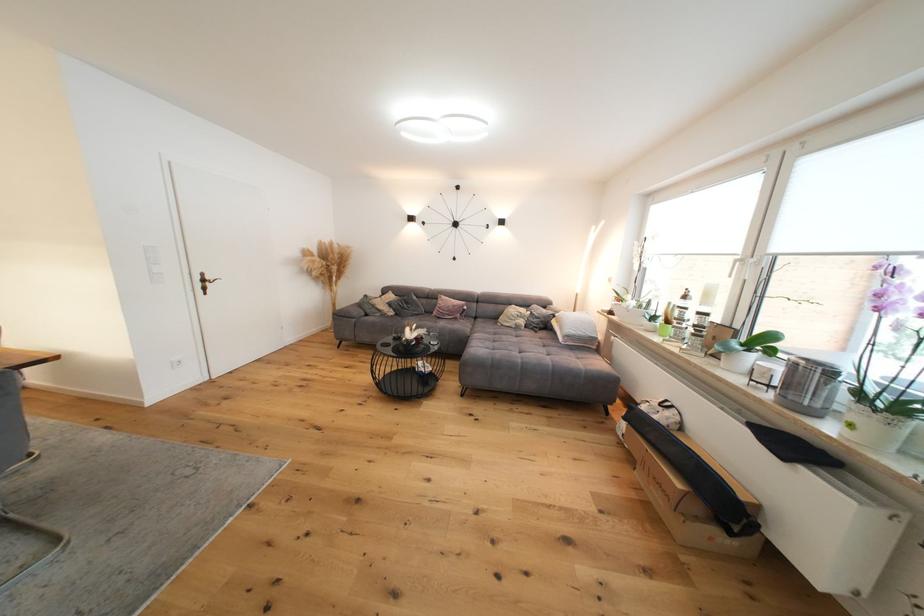
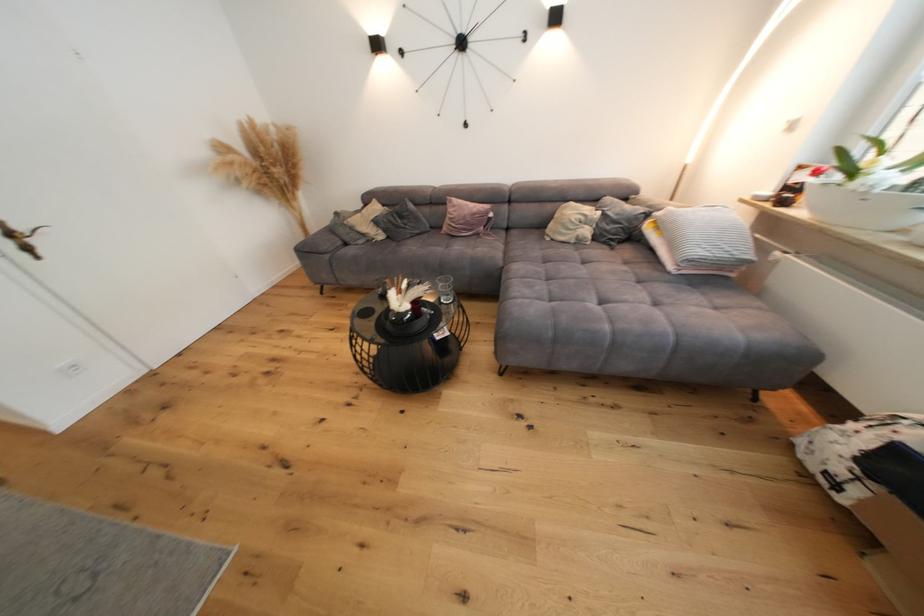
Locate, in the second image, the point that corresponds to (415,305) in the first image.

(408, 219)